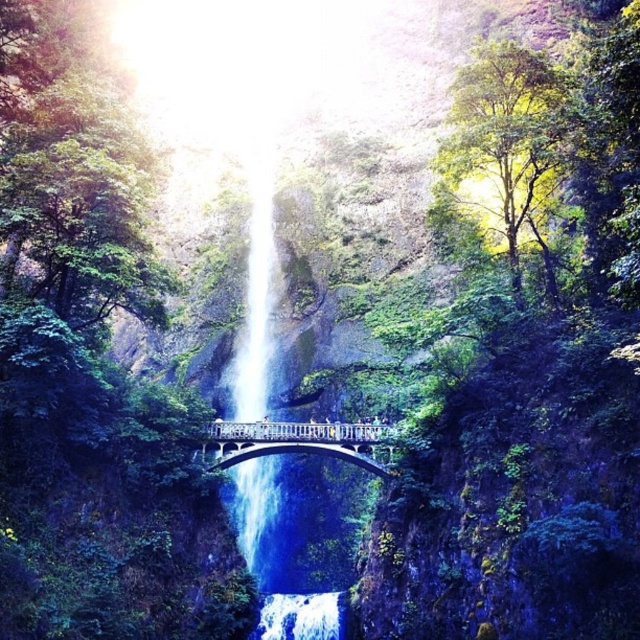
Question: Is white stone bridge at center above white frothy water at center?

Choices:
 (A) no
 (B) yes

Answer: (B)

Question: Is clear blue water at center above white stone bridge at center?

Choices:
 (A) yes
 (B) no

Answer: (A)

Question: Which object is positioned closest to the white frothy water at center?

Choices:
 (A) clear blue water at center
 (B) white stone bridge at center

Answer: (B)

Question: Does white stone bridge at center have a larger size compared to white frothy water at center?

Choices:
 (A) no
 (B) yes

Answer: (B)

Question: Which point is farther from the camera taking this photo?

Choices:
 (A) (211, 436)
 (B) (259, 524)
 (C) (285, 600)

Answer: (B)

Question: Estimate the real-world distances between objects in this image. Which object is farther from the white frothy water at center?

Choices:
 (A) white stone bridge at center
 (B) clear blue water at center

Answer: (B)